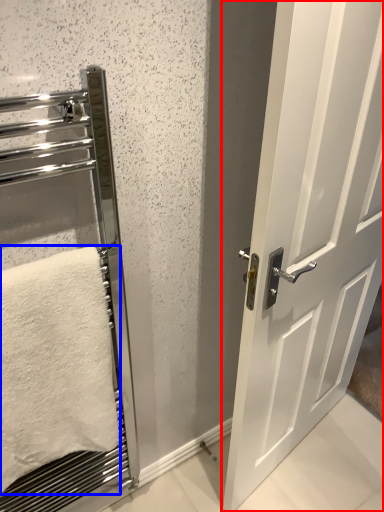
Question: Which object is closer to the camera taking this photo, door (highlighted by a red box) or towel (highlighted by a blue box)?

Choices:
 (A) door
 (B) towel

Answer: (A)